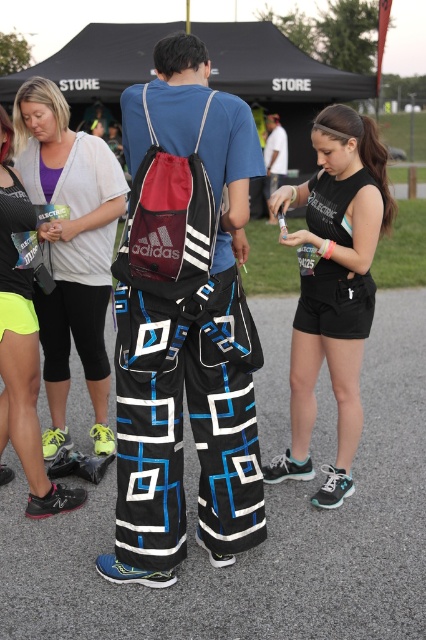
Question: Which point is closer to the camera taking this photo?

Choices:
 (A) (232, 147)
 (B) (143, 221)

Answer: (B)

Question: Does neon yellow leggings at lower left appear under white cotton t-shirt at center?

Choices:
 (A) no
 (B) yes

Answer: (B)

Question: Is black matte shorts at lower right to the left of red mesh backpack at center from the viewer's perspective?

Choices:
 (A) yes
 (B) no

Answer: (B)

Question: Which point is farther to the camera?

Choices:
 (A) (270, 129)
 (B) (238, 113)

Answer: (A)

Question: Which object is closer to the camera taking this photo?

Choices:
 (A) white cotton t-shirt at center
 (B) black synthetic pants at center

Answer: (A)

Question: Can you confirm if neon yellow leggings at lower left is wider than white cotton t-shirt at center?

Choices:
 (A) yes
 (B) no

Answer: (B)